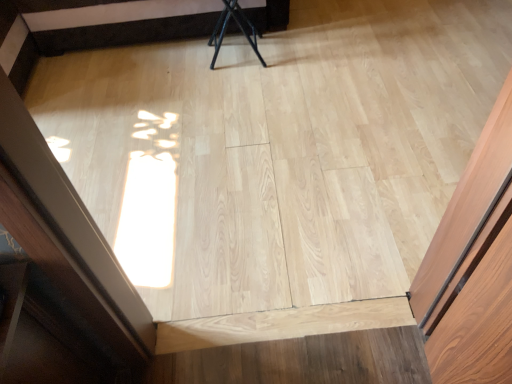
Where is `vacant space positioned to the left of black metal tripod at upper center`? The width and height of the screenshot is (512, 384). vacant space positioned to the left of black metal tripod at upper center is located at coordinates (188, 66).